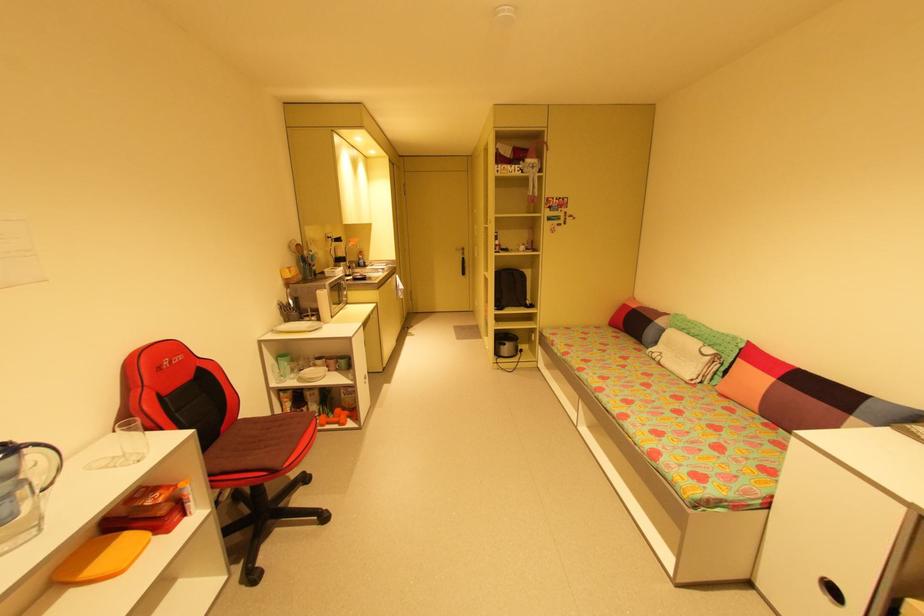
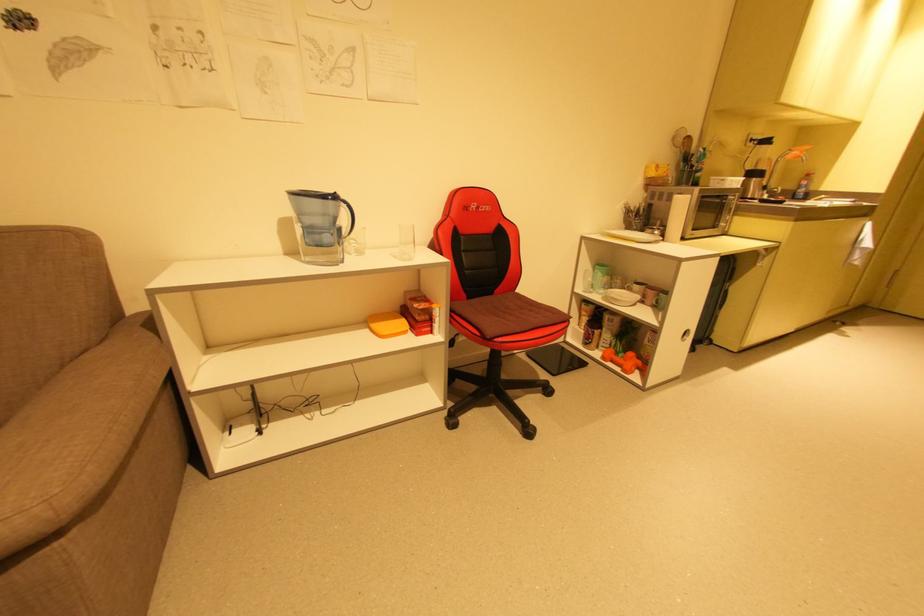
Find the pixel in the second image that matches point 30,450 in the first image.

(346, 204)